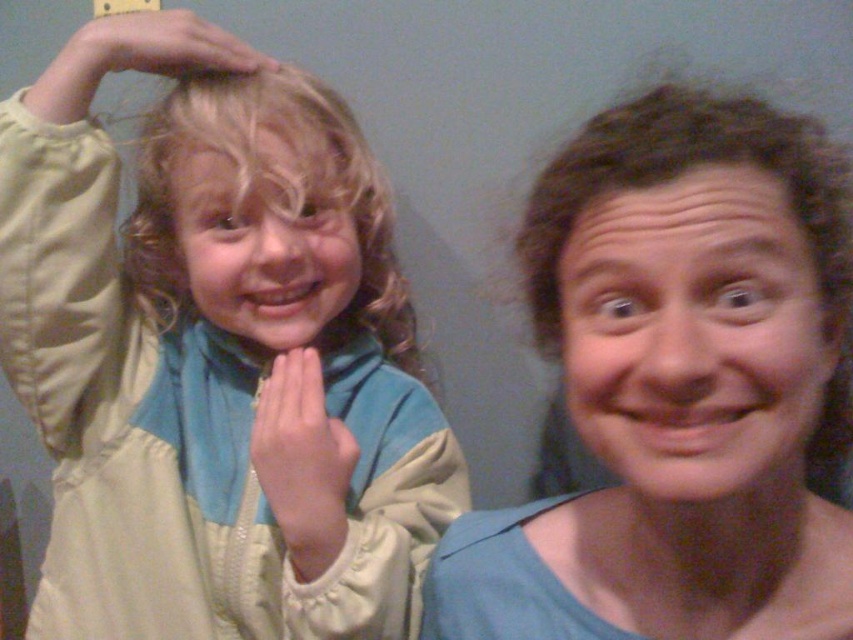
You are taking a photo of two people. The first person is at point (59, 108) and the second person is at point (120, 51). Which person is closer to the camera?

Point (59, 108) is further to the camera than point (120, 51), so the second person at point (120, 51) is closer to the camera.

You are a photographer adjusting the lighting for a portrait. The subject has blonde curly hair at upper left. Where should you position the light to ensure it highlights the hair effectively?

The blonde curly hair at upper left is located at point (270,196), so position the light opposite to that location to create a rim light effect.

You are a photographer trying to adjust the lighting for a photo shoot. You notice the matte beige jacket at left and the blonde curly hair at upper left. Which object should you focus the spotlight on to ensure it is illuminated properly, considering their sizes?

The matte beige jacket at left is much taller than the blonde curly hair at upper left, so you should focus the spotlight on the matte beige jacket at left to ensure it is illuminated properly.